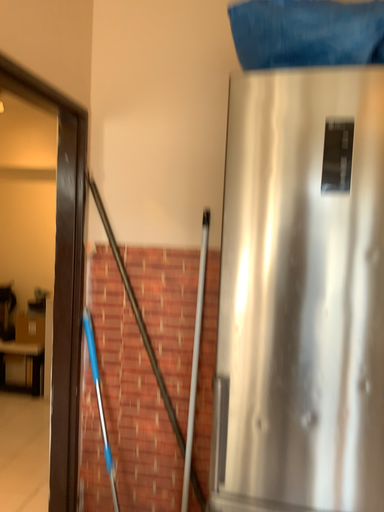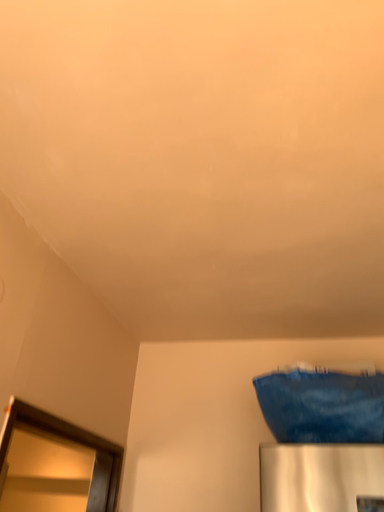
Question: How did the camera likely rotate when shooting the video?

Choices:
 (A) rotated downward
 (B) rotated upward

Answer: (B)